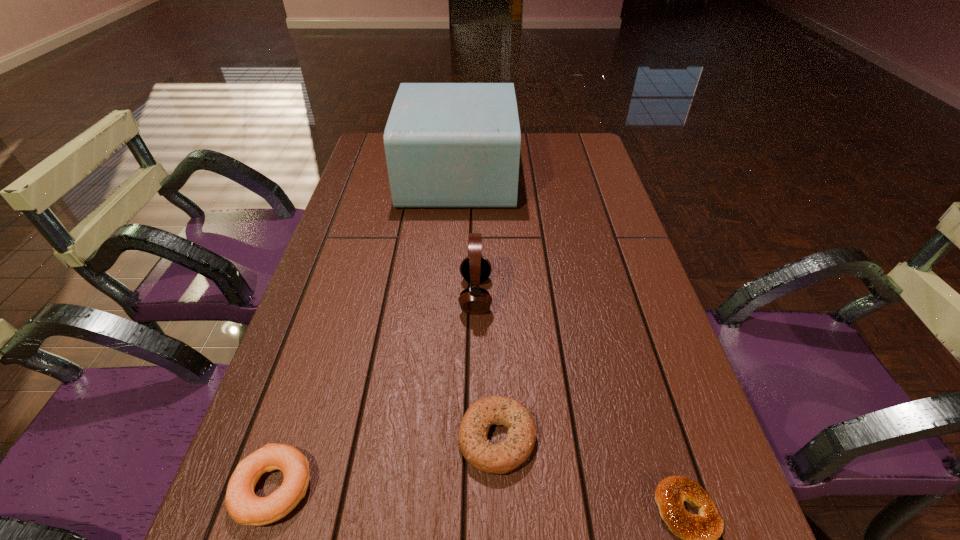
Where is `object located at the far edge`? object located at the far edge is located at coordinates (448, 145).

Identify the location of radio receiver that is at the left edge. (448, 145).

This screenshot has width=960, height=540. Find the location of `bagel at the left edge`. bagel at the left edge is located at coordinates (244, 507).

Identify the location of object that is positioned at the far left corner. The width and height of the screenshot is (960, 540). (448, 145).

You are a GUI agent. You are given a task and a screenshot of the screen. Output one action in this format:
    pyautogui.click(x=<x>, y=<y>)
    Task: Click on the vacant space at the far edge of the desktop
    This screenshot has height=540, width=960.
    Given the screenshot: What is the action you would take?
    pyautogui.click(x=522, y=162)

The height and width of the screenshot is (540, 960). I want to click on vacant space at the left edge of the desktop, so click(x=294, y=386).

You are a GUI agent. You are given a task and a screenshot of the screen. Output one action in this format:
    pyautogui.click(x=<x>, y=<y>)
    Task: Click on the vacant area at the right edge of the desktop
    The width and height of the screenshot is (960, 540).
    Given the screenshot: What is the action you would take?
    pyautogui.click(x=612, y=343)

In the image, there is a desktop. At what (x,y) coordinates should I click in order to perform the action: click on vacant space at the far left corner. Please return your answer as a coordinate pair (x, y). This screenshot has height=540, width=960. Looking at the image, I should click on (375, 162).

Locate an element on the screen. The width and height of the screenshot is (960, 540). vacant space at the far right corner of the desktop is located at coordinates (589, 143).

Identify the location of vacant space that's between the leftmost bagel and the second bagel from left to right. (385, 463).